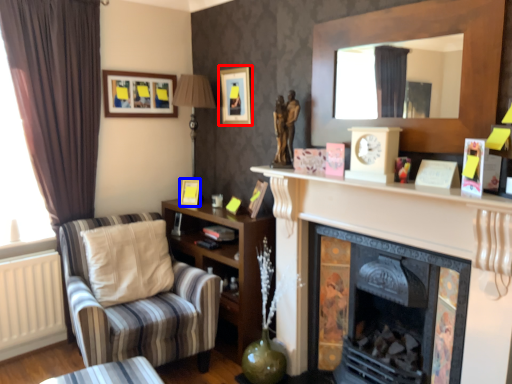
Question: Among these objects, which one is nearest to the camera, picture frame (highlighted by a red box) or picture frame (highlighted by a blue box)?

Choices:
 (A) picture frame
 (B) picture frame

Answer: (A)